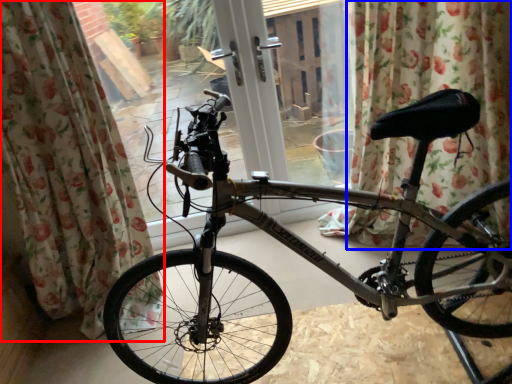
Question: Which object is further to the camera taking this photo, curtain (highlighted by a red box) or curtain (highlighted by a blue box)?

Choices:
 (A) curtain
 (B) curtain

Answer: (B)